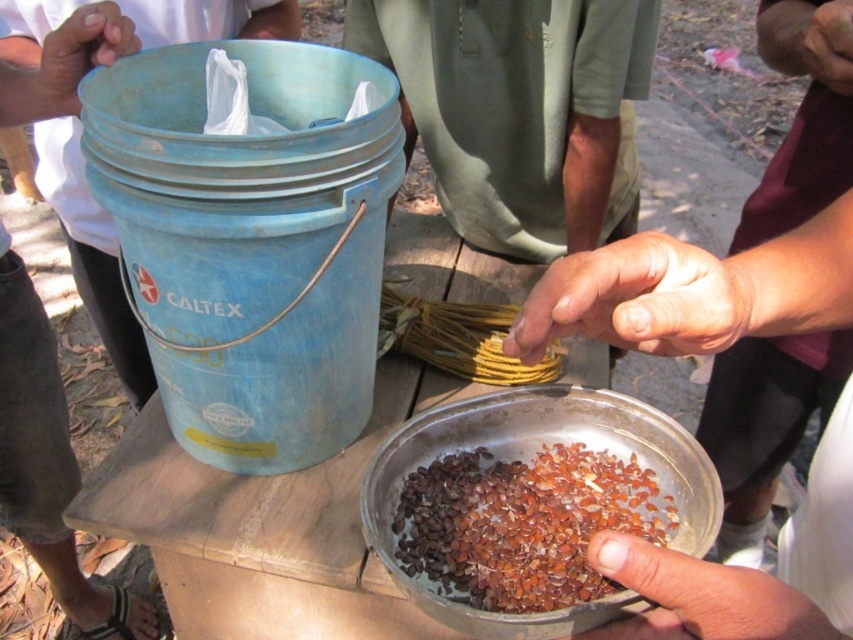
Can you confirm if brown glossy seeds at center is positioned to the right of dry skin at center?

Incorrect, brown glossy seeds at center is not on the right side of dry skin at center.

Which is in front, point (485, 460) or point (712, 301)?

Point (712, 301)

Locate an element on the screen. The width and height of the screenshot is (853, 640). brown glossy seeds at center is located at coordinates (523, 524).

Is brown matte finger at lower center positioned behind smooth skin hand at center?

No, it is in front of smooth skin hand at center.

Is brown matte finger at lower center below smooth skin hand at center?

Indeed, brown matte finger at lower center is positioned under smooth skin hand at center.

At what (x,y) coordinates should I click in order to perform the action: click on brown matte finger at lower center. Please return your answer as a coordinate pair (x, y). Looking at the image, I should click on (701, 596).

Identify the location of brown matte finger at lower center. (701, 596).

Between brown glossy seeds at center and smooth skin hand at center, which one has more height?

smooth skin hand at center is taller.

Can you confirm if brown glossy seeds at center is wider than smooth skin hand at center?

Indeed, brown glossy seeds at center has a greater width compared to smooth skin hand at center.

At what (x,y) coordinates should I click in order to perform the action: click on brown glossy seeds at center. Please return your answer as a coordinate pair (x, y). This screenshot has height=640, width=853. Looking at the image, I should click on (523, 524).

I want to click on brown glossy seeds at center, so click(523, 524).